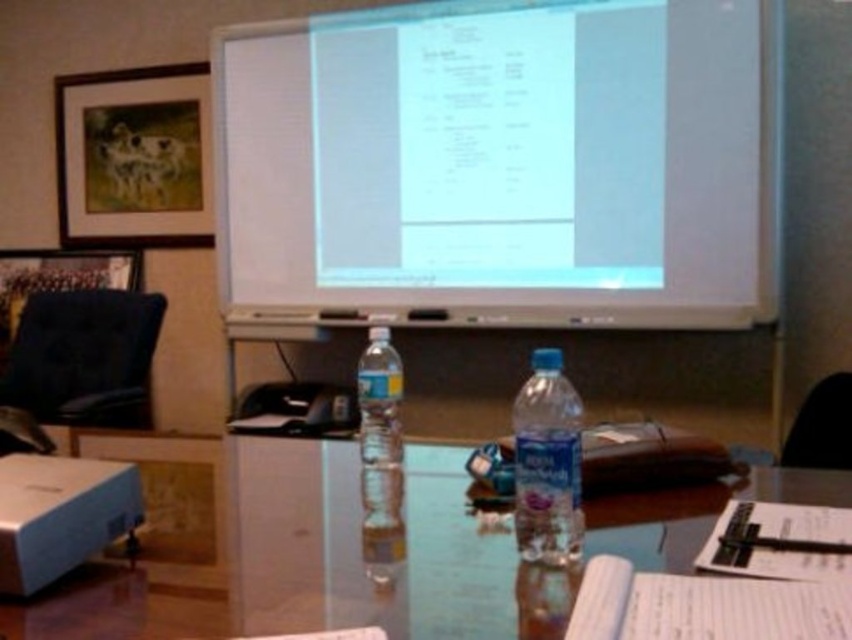
You are standing in the meeting room and need to place a laptop on the transparent glass table at center. Given the table is at coordinates point 0.869, 0.425, can you confirm the exact position to place it?

The transparent glass table at center is located at point (361, 556), so you should place the laptop precisely at those coordinates to ensure it is centered on the table.